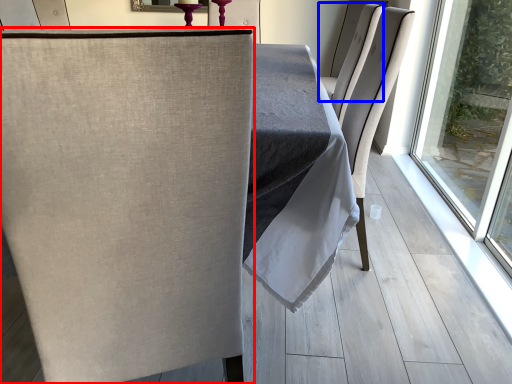
Question: Which point is closer to the camera, chair (highlighted by a red box) or chair (highlighted by a blue box)?

Choices:
 (A) chair
 (B) chair

Answer: (A)